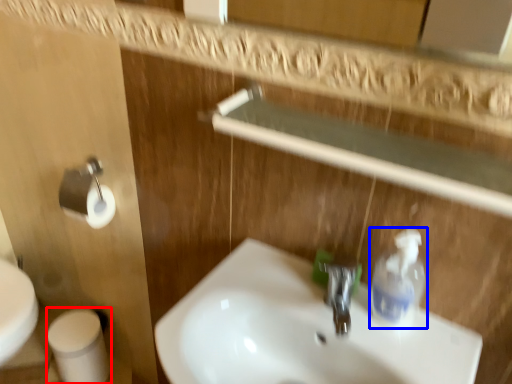
Question: Which object appears farthest to the camera in this image, toilet paper (highlighted by a red box) or cleaning product (highlighted by a blue box)?

Choices:
 (A) toilet paper
 (B) cleaning product

Answer: (A)